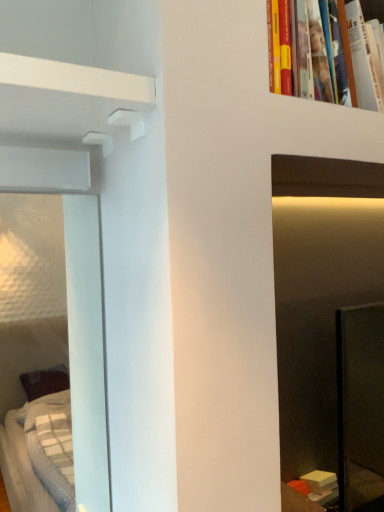
Question: Considering the positions of white matte shelf at upper left and hardcover book at upper right in the image, is white matte shelf at upper left wider or thinner than hardcover book at upper right?

Choices:
 (A) thin
 (B) wide

Answer: (B)

Question: From a real-world perspective, relative to hardcover book at upper right, is white matte shelf at upper left vertically above or below?

Choices:
 (A) below
 (B) above

Answer: (A)

Question: Considering the positions of white matte shelf at upper left and hardcover book at upper right in the image, is white matte shelf at upper left bigger or smaller than hardcover book at upper right?

Choices:
 (A) big
 (B) small

Answer: (B)

Question: Considering the positions of hardcover book at upper right and white matte shelf at upper left in the image, is hardcover book at upper right taller or shorter than white matte shelf at upper left?

Choices:
 (A) tall
 (B) short

Answer: (A)

Question: From the image's perspective, is hardcover book at upper right positioned above or below white matte shelf at upper left?

Choices:
 (A) below
 (B) above

Answer: (B)

Question: Is hardcover book at upper right wider or thinner than white matte shelf at upper left?

Choices:
 (A) thin
 (B) wide

Answer: (A)

Question: Which is correct: hardcover book at upper right is inside white matte shelf at upper left, or outside of it?

Choices:
 (A) inside
 (B) outside

Answer: (B)